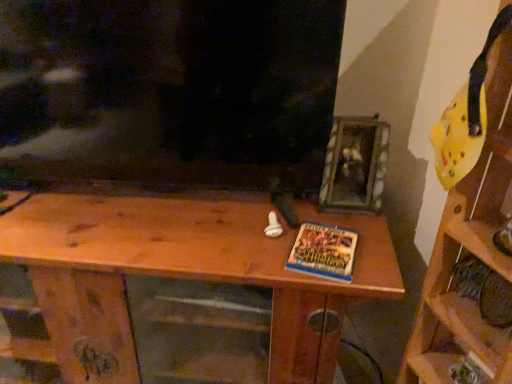
Question: Looking at their shapes, would you say blue glossy book at center is wider or thinner than yellow foam helmet at upper right, which is the first shelf from right to left?

Choices:
 (A) thin
 (B) wide

Answer: (A)

Question: Is blue glossy book at center to the left or to the right of yellow foam helmet at upper right, placed as the second shelf when sorted from left to right, in the image?

Choices:
 (A) right
 (B) left

Answer: (B)

Question: Which object is positioned farthest from the wooden table at center, which is counted as the first shelf, starting from the left?

Choices:
 (A) yellow foam helmet at upper right, which is the first shelf from right to left
 (B) blue glossy book at center

Answer: (A)

Question: Which is nearer to the wooden table at center, the 2th shelf positioned from the right?

Choices:
 (A) blue glossy book at center
 (B) yellow foam helmet at upper right, placed as the second shelf when sorted from left to right

Answer: (A)